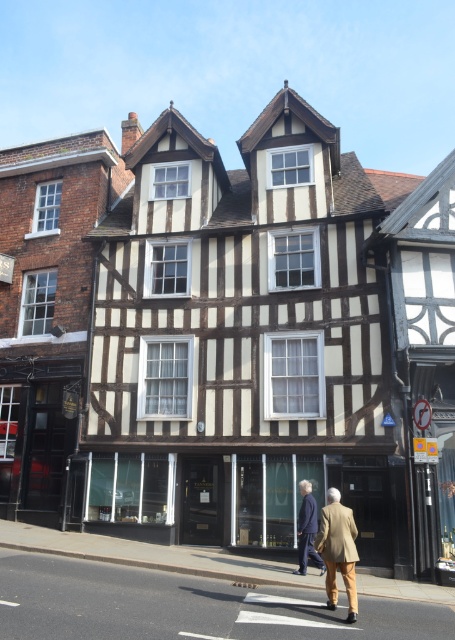
You are a delivery person standing at the entrance of the historic building. You need to place a light brown leather jacket at lower center exactly at the coordinates provided in the image. What are the coordinates where you should place it?

The coordinates for placing the light brown leather jacket at lower center are 0.861 on the x axis and 0.743 on the y axis.

You are a customer looking to purchase a light brown leather jacket from the shop. You want a jacket that is bigger in size. Which one between the light brown leather jacket at lower center and the light brown leather jacket at center should you choose?

The light brown leather jacket at lower center has a larger size compared to the light brown leather jacket at center, so you should choose the light brown leather jacket at lower center.